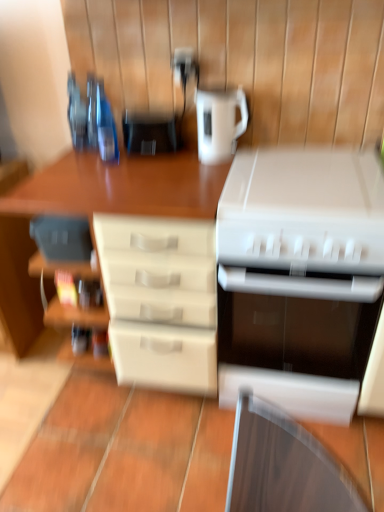
What do you see at coordinates (302, 281) in the screenshot? I see `white plastic printer at lower right, placed as the 1th kitchen appliance when sorted from bottom to top` at bounding box center [302, 281].

Where is `white glossy kettle at upper center, the 2th kitchen appliance ordered from the bottom`? The image size is (384, 512). white glossy kettle at upper center, the 2th kitchen appliance ordered from the bottom is located at coordinates (219, 123).

The height and width of the screenshot is (512, 384). Describe the element at coordinates (130, 455) in the screenshot. I see `white plastic printer at center` at that location.

This screenshot has height=512, width=384. I want to click on white plastic printer at lower right, placed as the 1th kitchen appliance when sorted from bottom to top, so click(x=302, y=281).

Could you tell me if white plastic electric outlet at upper center is facing white plastic printer at center?

No, white plastic electric outlet at upper center is not aimed at white plastic printer at center.

Does white plastic electric outlet at upper center have a smaller size compared to white plastic printer at center?

Yes, white plastic electric outlet at upper center is smaller than white plastic printer at center.

From the image's perspective, relative to white plastic printer at center, is white plastic electric outlet at upper center above or below?

Based on their image positions, white plastic electric outlet at upper center is located above white plastic printer at center.

Is white plastic electric outlet at upper center closer to camera compared to white plastic printer at center?

No, white plastic electric outlet at upper center is further to the viewer.

Is white glossy kettle at upper center, the 1th kitchen appliance from the top, spatially inside white plastic printer at lower right, the 2th kitchen appliance in the top-to-bottom sequence, or outside of it?

white glossy kettle at upper center, the 1th kitchen appliance from the top, is not inside white plastic printer at lower right, the 2th kitchen appliance in the top-to-bottom sequence, it's outside.

Image resolution: width=384 pixels, height=512 pixels. Identify the location of kitchen appliance behind the white plastic printer at lower right, the 2th kitchen appliance in the top-to-bottom sequence. (219, 123).

Does white glossy kettle at upper center, the 1th kitchen appliance from the top, have a greater width compared to white plastic printer at lower right, the 2th kitchen appliance in the top-to-bottom sequence?

In fact, white glossy kettle at upper center, the 1th kitchen appliance from the top, might be narrower than white plastic printer at lower right, the 2th kitchen appliance in the top-to-bottom sequence.

Which is in front, point (226, 130) or point (219, 279)?

The point (219, 279) is in front.

Does point (168, 124) come behind point (347, 209)?

Yes, point (168, 124) is behind point (347, 209).

Between matte black coffee maker at center, which appears as the 2th appliance when viewed from the right, and white plastic printer at center, which is the first appliance in bottom-to-top order, which one has more height?

With more height is white plastic printer at center, which is the first appliance in bottom-to-top order.

Does matte black coffee maker at center, which is counted as the first appliance, starting from the left, have a larger size compared to white plastic printer at center, acting as the first appliance starting from the right?

Actually, matte black coffee maker at center, which is counted as the first appliance, starting from the left, might be smaller than white plastic printer at center, acting as the first appliance starting from the right.

In the image, is matte black coffee maker at center, the 2th appliance from the bottom, positioned in front of or behind white plastic printer at center, acting as the first appliance starting from the right?

In the image, matte black coffee maker at center, the 2th appliance from the bottom, appears behind white plastic printer at center, acting as the first appliance starting from the right.

Is white plastic printer at lower right, the 2th kitchen appliance in the top-to-bottom sequence, bigger or smaller than matte white drawers at center?

Clearly, white plastic printer at lower right, the 2th kitchen appliance in the top-to-bottom sequence, is smaller in size than matte white drawers at center.

The height and width of the screenshot is (512, 384). Identify the location of the 2nd kitchen appliance counting from the right of the matte white drawers at center. (302, 281).

From the image's perspective, would you say white plastic printer at lower right, placed as the 1th kitchen appliance when sorted from bottom to top, is shown under matte white drawers at center?

Yes.

From the picture: Does white plastic printer at lower right, the 2th kitchen appliance in the top-to-bottom sequence, turn towards matte white drawers at center?

No, white plastic printer at lower right, the 2th kitchen appliance in the top-to-bottom sequence, is not turned towards matte white drawers at center.

From a real-world perspective, does white plastic electric outlet at upper center sit lower than matte black coffee maker at center, which appears as the 1th appliance when viewed from the top?

Incorrect, from a real-world perspective, white plastic electric outlet at upper center is higher than matte black coffee maker at center, which appears as the 1th appliance when viewed from the top.

From the picture: Which of these two, white plastic electric outlet at upper center or matte black coffee maker at center, the 2th appliance from the bottom, is wider?

matte black coffee maker at center, the 2th appliance from the bottom.

Is white plastic electric outlet at upper center next to matte black coffee maker at center, which appears as the 2th appliance when viewed from the right, and touching it?

No, white plastic electric outlet at upper center is not beside matte black coffee maker at center, which appears as the 2th appliance when viewed from the right.

How many degrees apart are the facing directions of white plastic electric outlet at upper center and matte black coffee maker at center, which appears as the 1th appliance when viewed from the top?

1.34 degrees separate the facing orientations of white plastic electric outlet at upper center and matte black coffee maker at center, which appears as the 1th appliance when viewed from the top.

Which is more to the left, white plastic printer at center, which is counted as the second appliance, starting from the left, or white plastic printer at center?

white plastic printer at center.

Which of these two, white plastic printer at center, which is the first appliance in bottom-to-top order, or white plastic printer at center, is bigger?

With larger size is white plastic printer at center, which is the first appliance in bottom-to-top order.

How different are the orientations of white plastic printer at center, acting as the first appliance starting from the right, and white plastic printer at center in degrees?

white plastic printer at center, acting as the first appliance starting from the right, and white plastic printer at center are facing 89.9 degrees away from each other.

Is white plastic printer at center, the second appliance viewed from the top, further to camera compared to white plastic printer at center?

That is False.

In the scene shown: Between white plastic printer at lower right, placed as the 1th kitchen appliance when sorted from bottom to top, and white glossy kettle at upper center, the 2th kitchen appliance ordered from the bottom, which one has more height?

With more height is white plastic printer at lower right, placed as the 1th kitchen appliance when sorted from bottom to top.

Is white glossy kettle at upper center, the 2th kitchen appliance ordered from the bottom, at the back of white plastic printer at lower right, placed as the 1th kitchen appliance when sorted from bottom to top?

No.

Is white plastic printer at lower right, placed as the 1th kitchen appliance when sorted from bottom to top, completely or partially outside of white glossy kettle at upper center, the 1th kitchen appliance from the top?

Yes, white plastic printer at lower right, placed as the 1th kitchen appliance when sorted from bottom to top, is outside of white glossy kettle at upper center, the 1th kitchen appliance from the top.

Is white plastic printer at lower right, placed as the 1th kitchen appliance when sorted from bottom to top, not near white glossy kettle at upper center, the 1th kitchen appliance from the top?

white plastic printer at lower right, placed as the 1th kitchen appliance when sorted from bottom to top, is actually quite close to white glossy kettle at upper center, the 1th kitchen appliance from the top.

At what (x,y) coordinates should I click in order to perform the action: click on desk that appears below the white plastic electric outlet at upper center (from the image's perspective). Please return your answer as a coordinate pair (x, y). This screenshot has width=384, height=512. Looking at the image, I should click on (130, 455).

I want to click on kitchen appliance on the left side of white plastic printer at lower right, the 2th kitchen appliance in the top-to-bottom sequence, so 219,123.

Considering their positions, is matte white drawers at center positioned closer to white glossy kettle at upper center, the 2th kitchen appliance ordered from the bottom, than white plastic electric outlet at upper center?

The object closer to white glossy kettle at upper center, the 2th kitchen appliance ordered from the bottom, is white plastic electric outlet at upper center.

Which object lies nearer to the anchor point white plastic printer at center, the second appliance viewed from the top, white plastic printer at center or white glossy kettle at upper center, the 2th kitchen appliance ordered from the bottom?

The object closer to white plastic printer at center, the second appliance viewed from the top, is white glossy kettle at upper center, the 2th kitchen appliance ordered from the bottom.

From the image, which object appears to be farther from white glossy kettle at upper center, the 1th kitchen appliance from the top, white plastic electric outlet at upper center or matte white drawers at center?

matte white drawers at center.

Estimate the real-world distances between objects in this image. Which object is closer to white plastic printer at center, matte black coffee maker at center, which is counted as the first appliance, starting from the left, or white plastic electric outlet at upper center?

matte black coffee maker at center, which is counted as the first appliance, starting from the left, is closer to white plastic printer at center.

Based on their spatial positions, is white glossy kettle at upper center, the 1th kitchen appliance from the top, or white plastic printer at center closer to matte white drawers at center?

Based on the image, white glossy kettle at upper center, the 1th kitchen appliance from the top, appears to be nearer to matte white drawers at center.

From the image, which object appears to be farther from matte white drawers at center, white plastic electric outlet at upper center or white glossy kettle at upper center, the 1th kitchen appliance from the top?

white plastic electric outlet at upper center lies further to matte white drawers at center than the other object.

Estimate the real-world distances between objects in this image. Which object is closer to matte white drawers at center, white plastic printer at center, acting as the first appliance starting from the right, or white glossy kettle at upper center, the 2th kitchen appliance ordered from the bottom?

Based on the image, white glossy kettle at upper center, the 2th kitchen appliance ordered from the bottom, appears to be nearer to matte white drawers at center.

Estimate the real-world distances between objects in this image. Which object is further from matte white drawers at center, matte black coffee maker at center, which appears as the 1th appliance when viewed from the top, or white plastic printer at lower right, the 2th kitchen appliance in the top-to-bottom sequence?

The object further to matte white drawers at center is white plastic printer at lower right, the 2th kitchen appliance in the top-to-bottom sequence.

I want to click on computer desk that lies between matte black coffee maker at center, which appears as the 2th appliance when viewed from the right, and white plastic printer at lower right, placed as the 1th kitchen appliance when sorted from bottom to top, from top to bottom, so click(x=120, y=187).

Where is `kitchen appliance between white plastic electric outlet at upper center and white plastic printer at center, which is the first appliance in bottom-to-top order, vertically`? kitchen appliance between white plastic electric outlet at upper center and white plastic printer at center, which is the first appliance in bottom-to-top order, vertically is located at coordinates (219, 123).

Where is `computer desk between white plastic printer at center, which is counted as the second appliance, starting from the left, and white plastic printer at center from top to bottom`? computer desk between white plastic printer at center, which is counted as the second appliance, starting from the left, and white plastic printer at center from top to bottom is located at coordinates (120, 187).

Where is `computer desk between white glossy kettle at upper center, the 1th kitchen appliance from the top, and white plastic printer at lower right, placed as the 1th kitchen appliance when sorted from bottom to top, in the up-down direction`? Image resolution: width=384 pixels, height=512 pixels. computer desk between white glossy kettle at upper center, the 1th kitchen appliance from the top, and white plastic printer at lower right, placed as the 1th kitchen appliance when sorted from bottom to top, in the up-down direction is located at coordinates (120, 187).